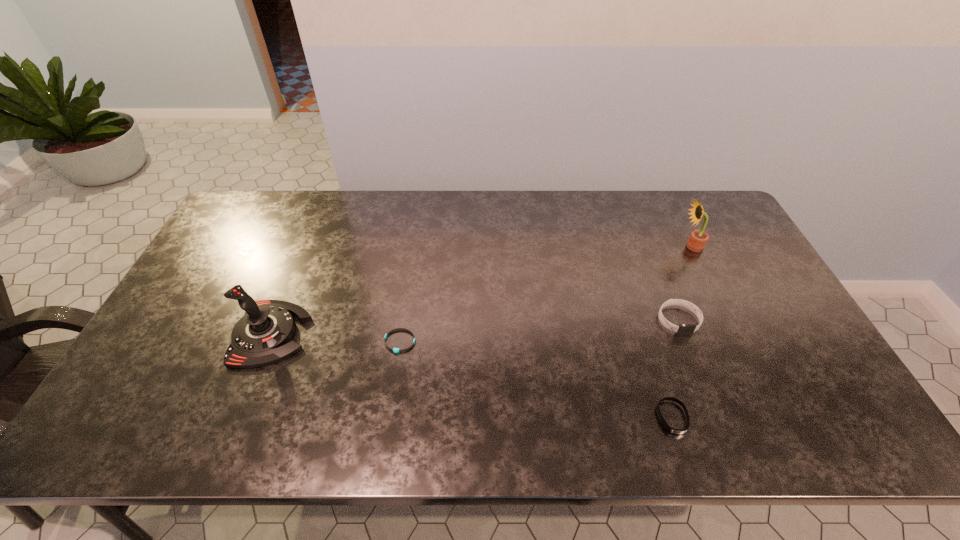
Find the location of a particular element. sunflower is located at coordinates (698, 238).

Locate an element on the screen. The image size is (960, 540). the farthest object is located at coordinates (698, 238).

Where is `joystick`? The height and width of the screenshot is (540, 960). joystick is located at coordinates (262, 336).

Where is `the second object from right to left`? the second object from right to left is located at coordinates (683, 329).

Where is `the tallest wristband`? the tallest wristband is located at coordinates (683, 329).

Locate an element on the screen. The image size is (960, 540). the second tallest wristband is located at coordinates (676, 431).

The height and width of the screenshot is (540, 960). I want to click on the second wristband from left to right, so click(x=676, y=431).

Identify the location of the fourth object from right to left. (396, 350).

This screenshot has width=960, height=540. I want to click on the shortest object, so coord(396,350).

Find the location of a particular element. The image size is (960, 540). free point located 0.200m on the face of the sunflower is located at coordinates click(618, 246).